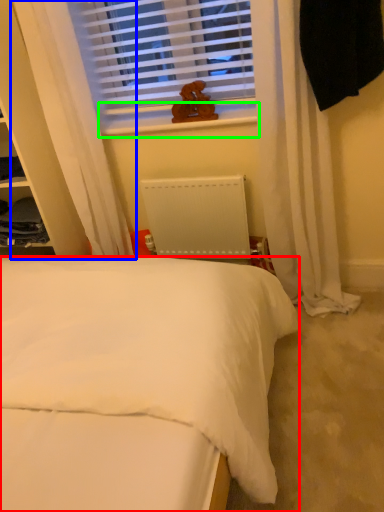
Question: Considering the real-world distances, which object is farthest from bed (highlighted by a red box)? curtain (highlighted by a blue box) or window sill (highlighted by a green box)?

Choices:
 (A) curtain
 (B) window sill

Answer: (B)